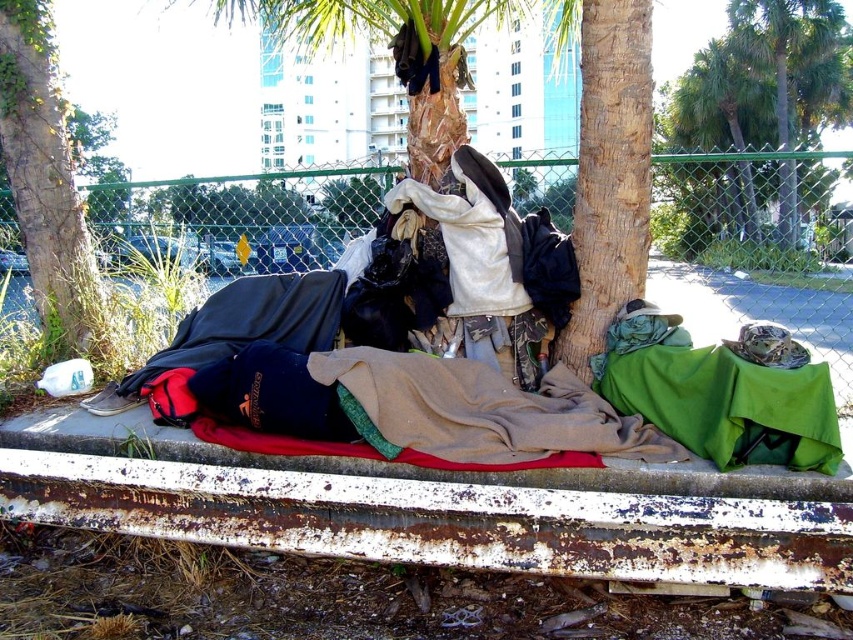
Looking at this image, you are a city planner assessing urban spaces for homeless support services. You observe the camouflage fabric clothing at center and the green rough bark tree at lower left in the scene. Which object takes up more space in the image?

The camouflage fabric clothing at center is larger in size than the green rough bark tree at lower left, so it occupies more space in the image.

You are a city planner assessing urban spaces. You notice two items in the image, the camouflage fabric pants at center and the bark textured tree at center. Which item takes up more space in the scene?

The camouflage fabric pants at center is larger in size than the bark textured tree at center, so it takes up more space in the scene.